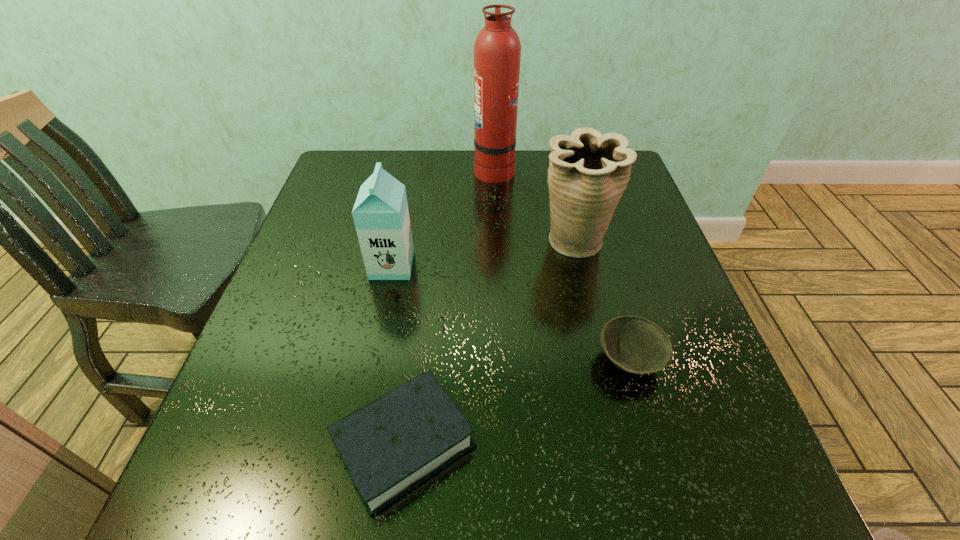
This screenshot has height=540, width=960. In order to click on the farthest object in this screenshot , I will do `click(497, 49)`.

Find the location of a particular element. The height and width of the screenshot is (540, 960). fire extinguisher is located at coordinates (497, 49).

In order to click on urn in this screenshot , I will do `click(588, 172)`.

The image size is (960, 540). Identify the location of milk carton. (381, 216).

Where is `bowl`? The width and height of the screenshot is (960, 540). bowl is located at coordinates (634, 344).

This screenshot has width=960, height=540. Identify the location of Bible. (392, 444).

Where is `free location located on the label side of the fire extinguisher`? The image size is (960, 540). free location located on the label side of the fire extinguisher is located at coordinates (396, 169).

At what (x,y) coordinates should I click in order to perform the action: click on vacant space situated 0.080m on the label side of the fire extinguisher. Please return your answer as a coordinate pair (x, y). The height and width of the screenshot is (540, 960). Looking at the image, I should click on (446, 169).

Find the location of a particular element. vacant space located on the label side of the fire extinguisher is located at coordinates (341, 169).

Find the location of a particular element. This screenshot has height=540, width=960. vacant space located 0.100m on the right of the urn is located at coordinates (651, 242).